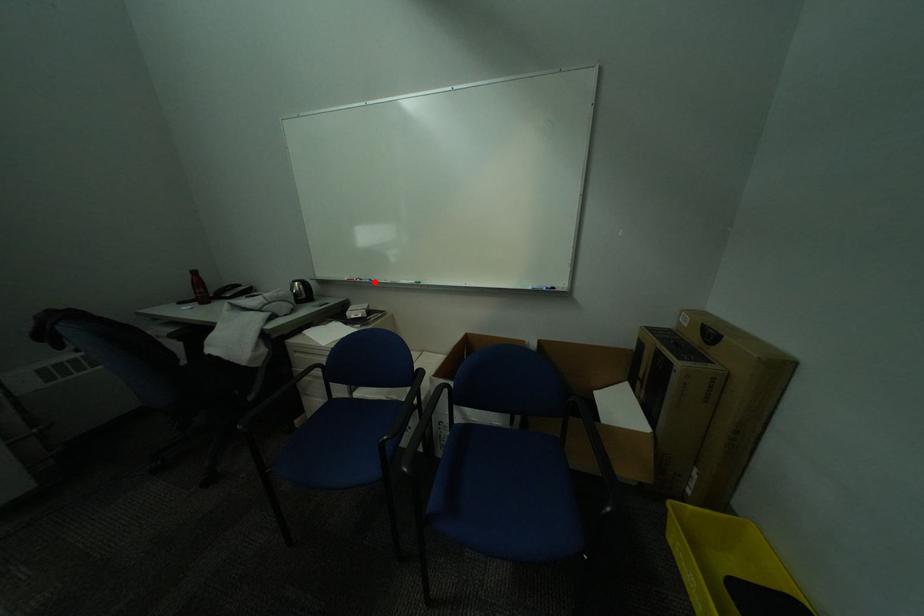
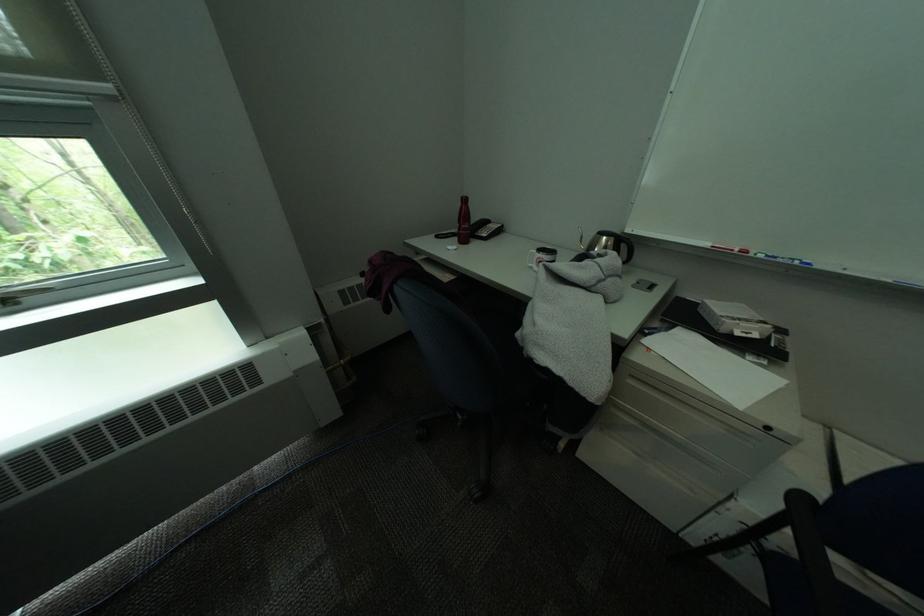
Locate, in the second image, the point that corresponds to the highlighted location in the first image.

(791, 262)